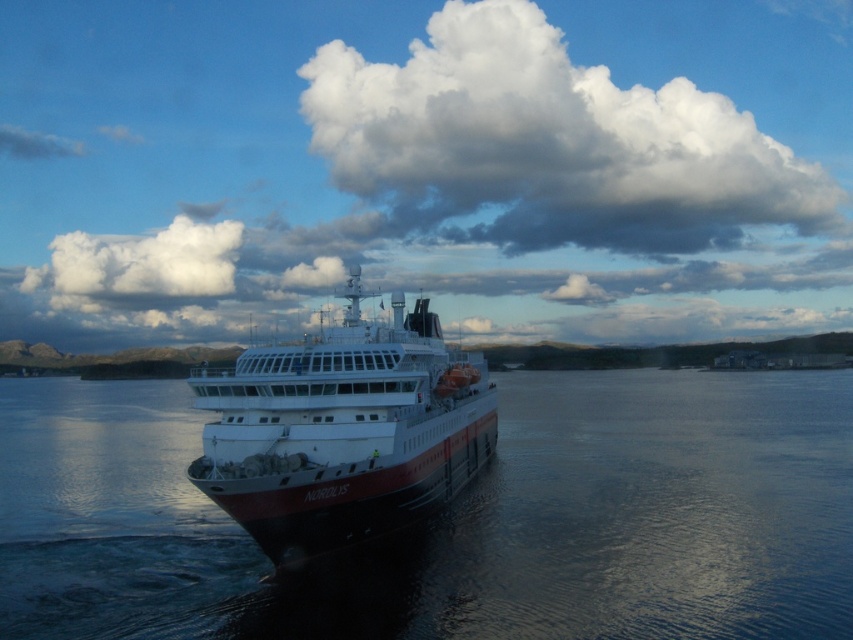
Does glossy water at center come behind white fluffy cloud at upper center?

No, glossy water at center is in front of white fluffy cloud at upper center.

Image resolution: width=853 pixels, height=640 pixels. I want to click on glossy water at center, so click(453, 518).

At what (x,y) coordinates should I click in order to perform the action: click on glossy water at center. Please return your answer as a coordinate pair (x, y). Image resolution: width=853 pixels, height=640 pixels. Looking at the image, I should click on (453, 518).

Can you confirm if glossy water at center is thinner than white glossy ship at center?

Incorrect, glossy water at center's width is not less than white glossy ship at center's.

Does glossy water at center appear on the left side of white glossy ship at center?

Incorrect, glossy water at center is not on the left side of white glossy ship at center.

Where is `glossy water at center`? glossy water at center is located at coordinates (453, 518).

Which is in front, point (647, 177) or point (250, 412)?

Point (250, 412) is in front.

Does white fluffy cloud at upper center appear under white glossy ship at center?

Actually, white fluffy cloud at upper center is above white glossy ship at center.

Identify the location of white fluffy cloud at upper center. (550, 144).